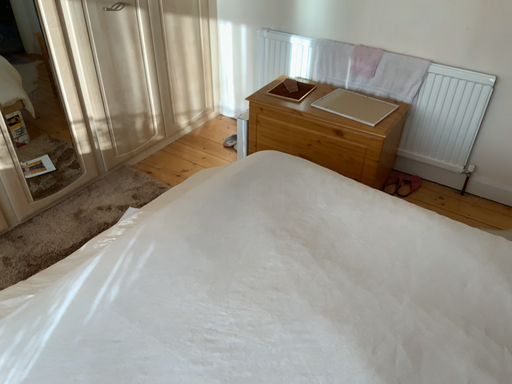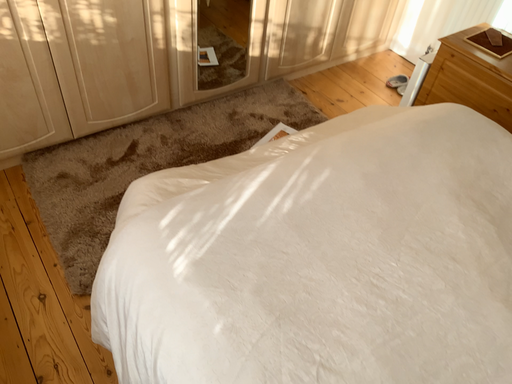
Question: Which way did the camera rotate in the video?

Choices:
 (A) rotated downward
 (B) rotated upward

Answer: (A)